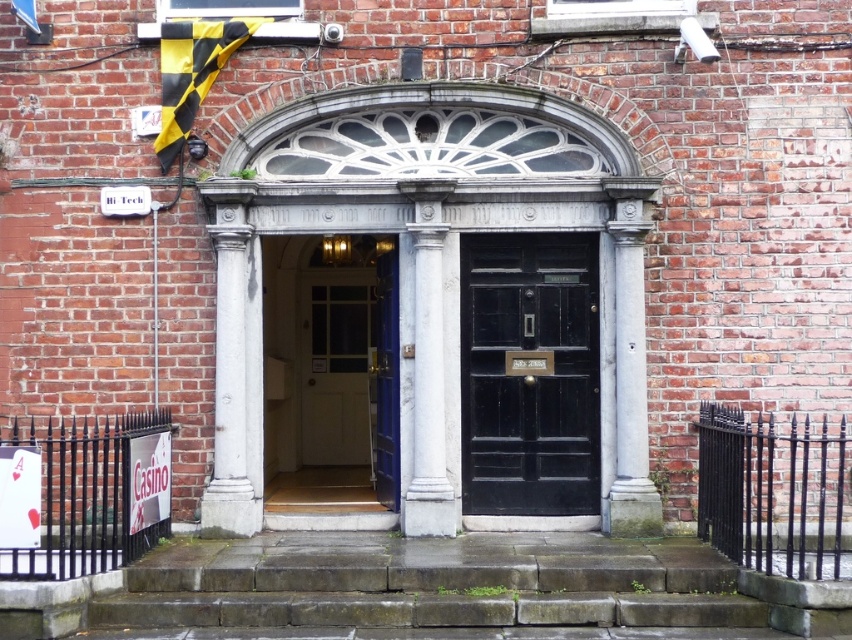
Does black polished wood door at center have a smaller size compared to white marble column at center?

Correct, black polished wood door at center occupies less space than white marble column at center.

Between black polished wood door at center and white marble column at center, which one has more height?

white marble column at center

I want to click on black polished wood door at center, so click(528, 372).

Which is in front, point (527, 291) or point (639, 346)?

Positioned in front is point (639, 346).

Between point (475, 500) and point (632, 458), which one is positioned in front?

Point (632, 458) is in front.

The image size is (852, 640). What are the coordinates of `black polished wood door at center` in the screenshot? It's located at (528, 372).

Can you confirm if white wooden door at center is taller than white marble column at center?

In fact, white wooden door at center may be shorter than white marble column at center.

Is white wooden door at center in front of white marble column at center?

No, it is behind white marble column at center.

Between point (349, 467) and point (432, 211), which one is positioned in front?

Point (432, 211)

Where is `white wooden door at center`? The width and height of the screenshot is (852, 640). white wooden door at center is located at coordinates (331, 378).